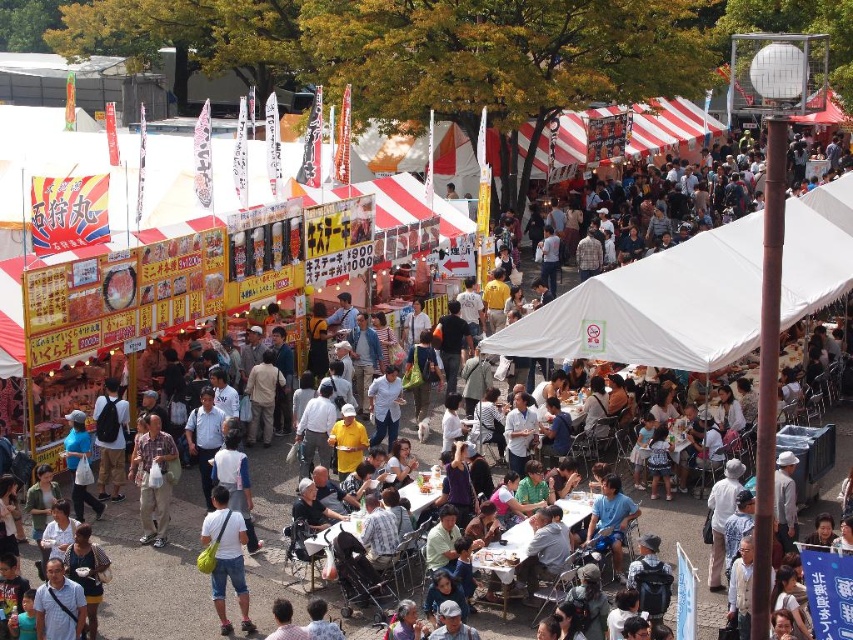
Question: Does white fabric canopy at center appear under white matte shirt at center?

Choices:
 (A) no
 (B) yes

Answer: (A)

Question: Among these objects, which one is farthest from the camera?

Choices:
 (A) white matte shirt at center
 (B) white fabric canopy at center
 (C) plaid shirt at center

Answer: (C)

Question: Does white fabric canopy at center have a larger size compared to plaid shirt at center?

Choices:
 (A) no
 (B) yes

Answer: (B)

Question: Can you confirm if white fabric canopy at center is positioned to the left of white matte shirt at center?

Choices:
 (A) yes
 (B) no

Answer: (B)

Question: Among these points, which one is farthest from the camera?

Choices:
 (A) (653, 342)
 (B) (154, 513)
 (C) (216, 516)

Answer: (A)

Question: Estimate the real-world distances between objects in this image. Which object is closer to the white matte shirt at center?

Choices:
 (A) plaid shirt at center
 (B) white fabric canopy at center

Answer: (A)